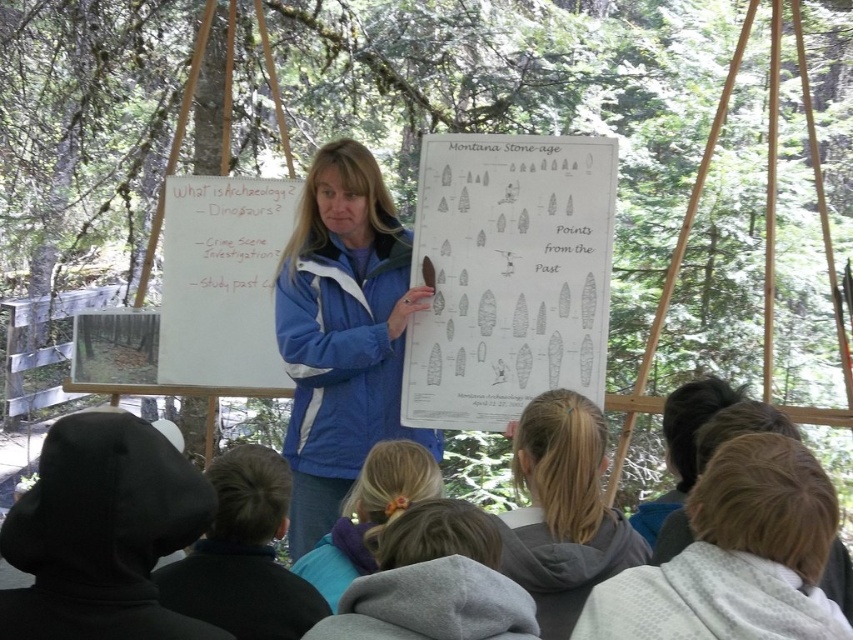
You are a child in the audience looking at the white paper at center and the light blue hoodie at lower center. Which object is taller?

The white paper at center is much taller than the light blue hoodie at lower center.

Consider the image. Looking at the scene where a woman is teaching children about archaeology using two whiteboards, you notice a person with blonde hair at center and a light blue hoodie at lower center. Which of these two items is located higher in the image?

The blonde hair at center is positioned over the light blue hoodie at lower center, meaning it is higher in the image.